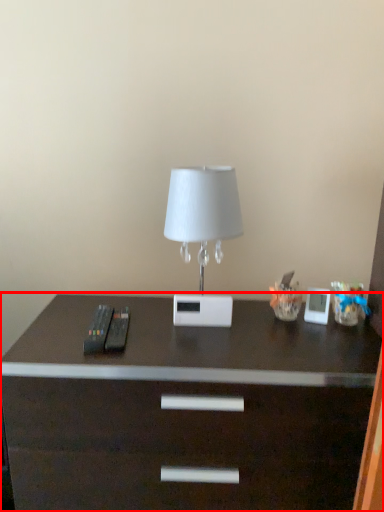
Question: From the image's perspective, where is desk (annotated by the red box) located relative to lamp?

Choices:
 (A) above
 (B) below

Answer: (B)